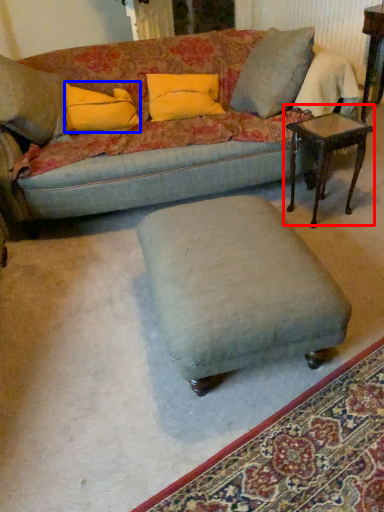
Question: Which object appears farthest to the camera in this image, table (highlighted by a red box) or pillow (highlighted by a blue box)?

Choices:
 (A) table
 (B) pillow

Answer: (B)